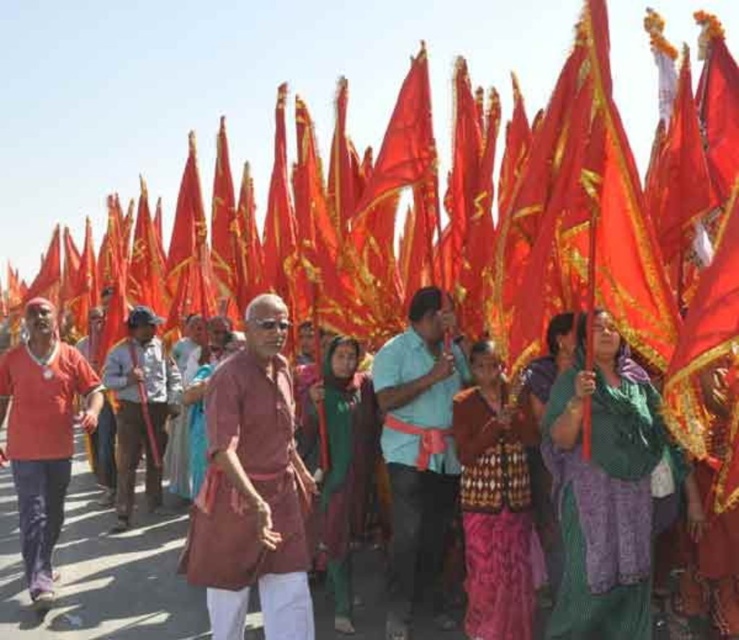
Is silky red fabric at center taller than green fabric dress at center?

No.

What do you see at coordinates (102, 573) in the screenshot?
I see `silky red fabric at center` at bounding box center [102, 573].

At what (x,y) coordinates should I click in order to perform the action: click on silky red fabric at center. Please return your answer as a coordinate pair (x, y). This screenshot has width=739, height=640. Looking at the image, I should click on point(102,573).

Between maroon fabric kurta at center and patterned fabric sari at center, which one appears on the left side from the viewer's perspective?

maroon fabric kurta at center

Can you confirm if maroon fabric kurta at center is bigger than patterned fabric sari at center?

Correct, maroon fabric kurta at center is larger in size than patterned fabric sari at center.

You are a GUI agent. You are given a task and a screenshot of the screen. Output one action in this format:
    pyautogui.click(x=<x>, y=<y>)
    Task: Click on the maroon fabric kurta at center
    
    Given the screenshot: What is the action you would take?
    pyautogui.click(x=252, y=490)

Between point (517, 406) and point (149, 440), which one is positioned in front?

Point (517, 406) is more forward.

Which is more to the left, patterned fabric sari at center or brown leather cap at center?

brown leather cap at center is more to the left.

What do you see at coordinates (494, 502) in the screenshot? I see `patterned fabric sari at center` at bounding box center [494, 502].

This screenshot has width=739, height=640. What are the coordinates of `patterned fabric sari at center` in the screenshot? It's located at (494, 502).